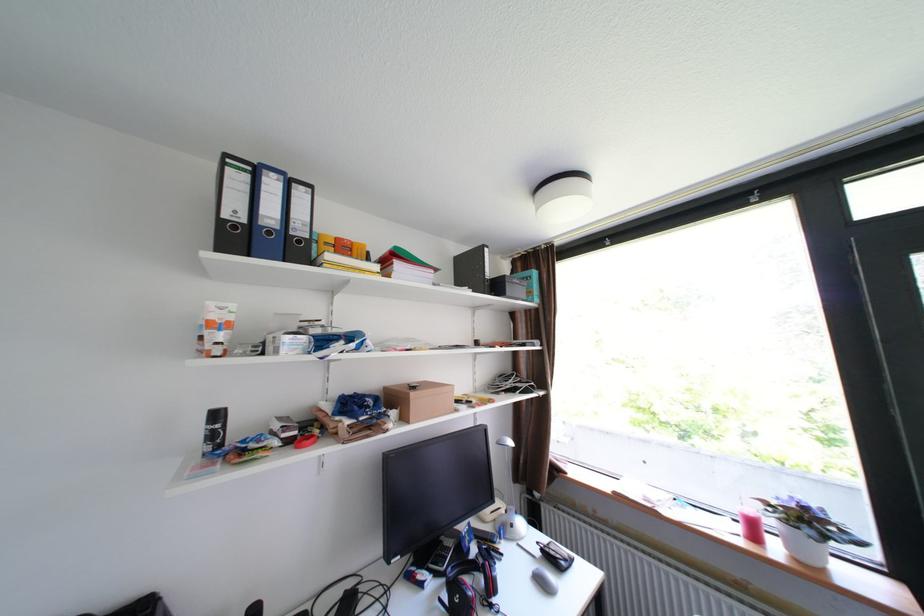
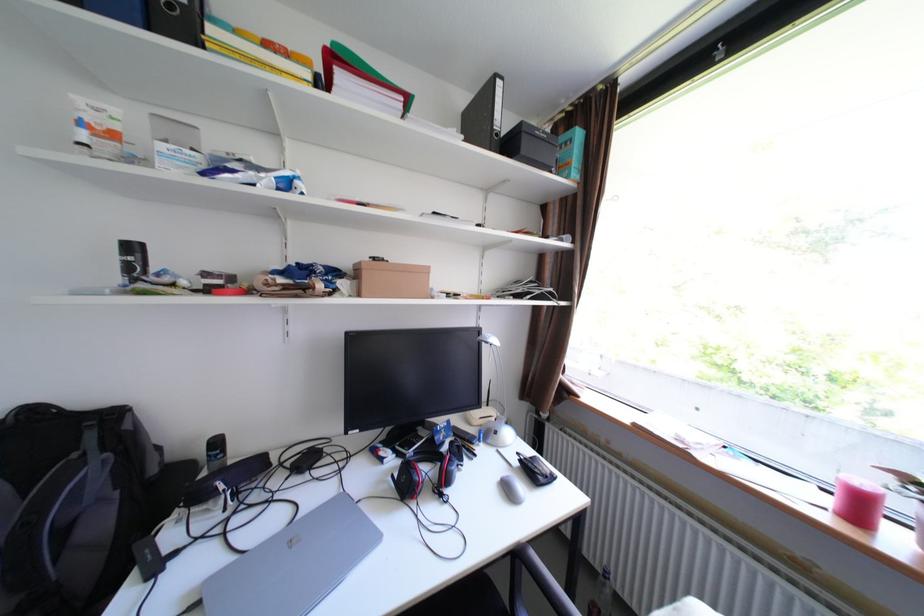
In the second image, find the point that corresponds to point (227, 415) in the first image.

(143, 248)